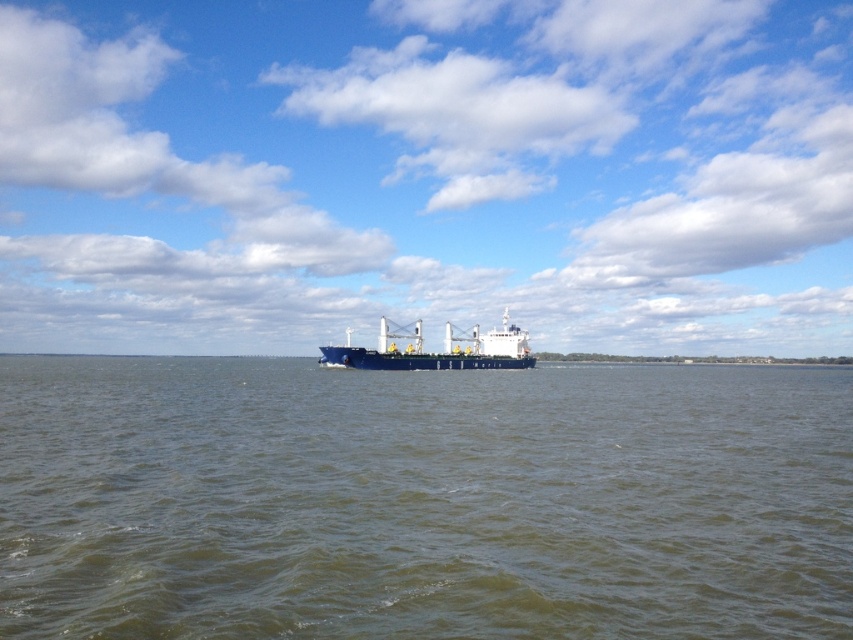
Question: Among these points, which one is farthest from the camera?

Choices:
 (A) (247, 417)
 (B) (379, 324)

Answer: (B)

Question: Can you confirm if greenish water at center is positioned to the right of blue matte cargo ship at center?

Choices:
 (A) yes
 (B) no

Answer: (A)

Question: Is greenish water at center behind blue matte cargo ship at center?

Choices:
 (A) no
 (B) yes

Answer: (A)

Question: Is greenish water at center to the left of blue matte cargo ship at center from the viewer's perspective?

Choices:
 (A) yes
 (B) no

Answer: (B)

Question: Which point is closer to the camera?

Choices:
 (A) greenish water at center
 (B) blue matte cargo ship at center

Answer: (A)

Question: Which point is farther from the camera taking this photo?

Choices:
 (A) (424, 368)
 (B) (393, 406)

Answer: (A)